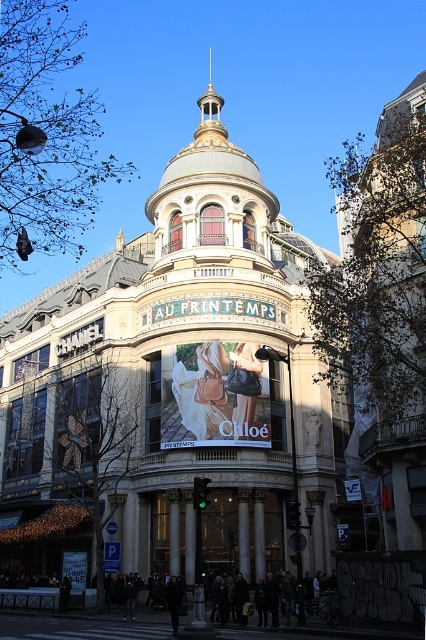
Question: Is gold metallic dome at center wider than leather handbag at center?

Choices:
 (A) no
 (B) yes

Answer: (B)

Question: Does gold metallic dome at center come in front of matte leather handbag at center?

Choices:
 (A) yes
 (B) no

Answer: (A)

Question: Which of the following is the farthest from the observer?

Choices:
 (A) white glossy signboard at center
 (B) matte leather handbag at center

Answer: (A)

Question: Does gold metallic dome at center have a greater width compared to matte leather handbag at center?

Choices:
 (A) yes
 (B) no

Answer: (A)

Question: Which of the following is the closest to the observer?

Choices:
 (A) (203, 355)
 (B) (184, 385)
 (C) (75, 561)
 (D) (244, 372)

Answer: (B)

Question: Which object appears closest to the camera in this image?

Choices:
 (A) gold metallic dome at center
 (B) matte leather handbag at center
 (C) leather handbag at center
 (D) white glossy signboard at center

Answer: (A)